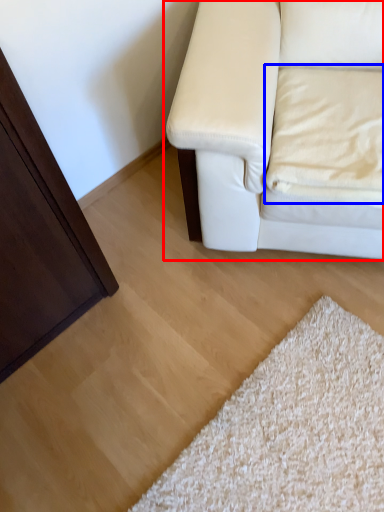
Question: Which of the following is the farthest to the observer, studio couch (highlighted by a red box) or pillow (highlighted by a blue box)?

Choices:
 (A) studio couch
 (B) pillow

Answer: (B)